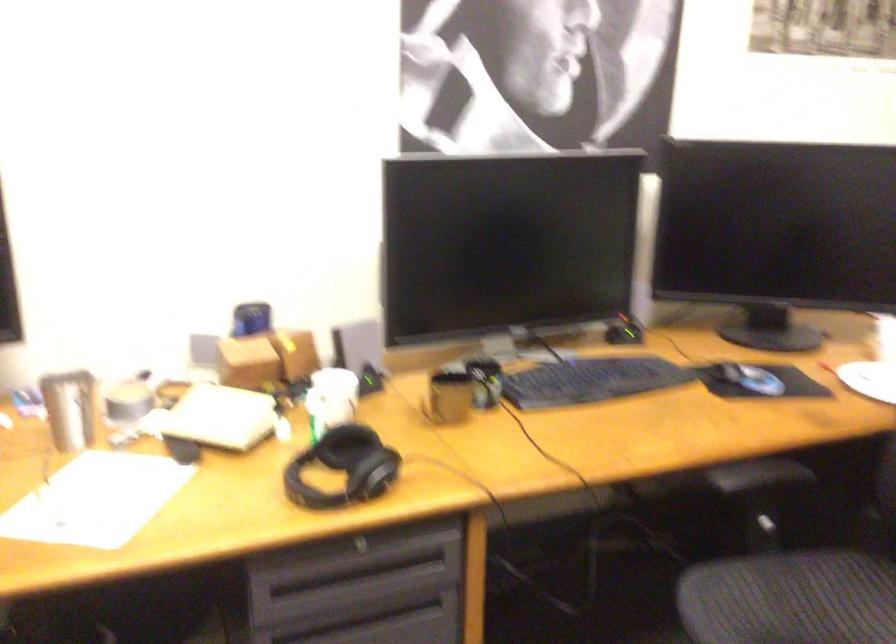
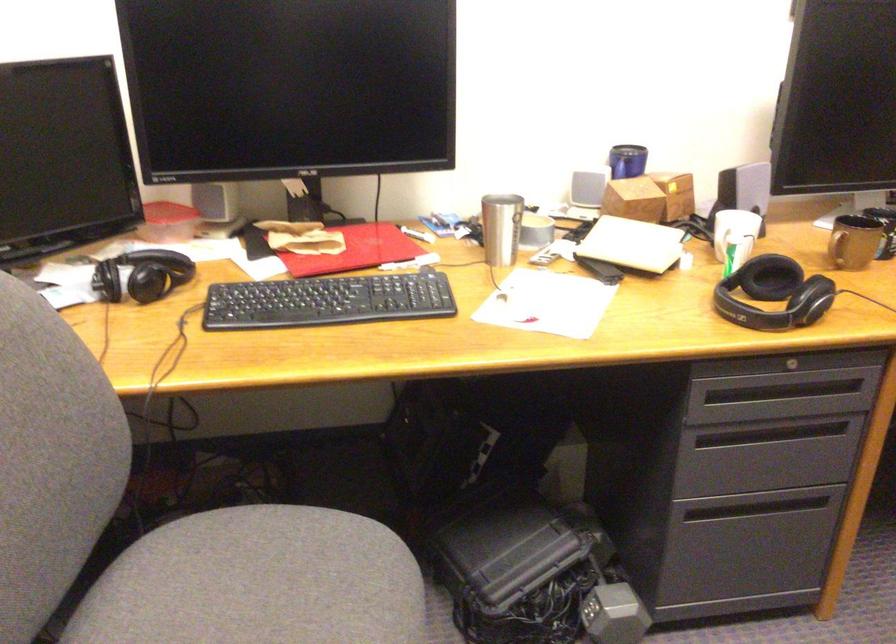
The point at (x=444, y=406) is marked in the first image. Where is the corresponding point in the second image?

(854, 242)